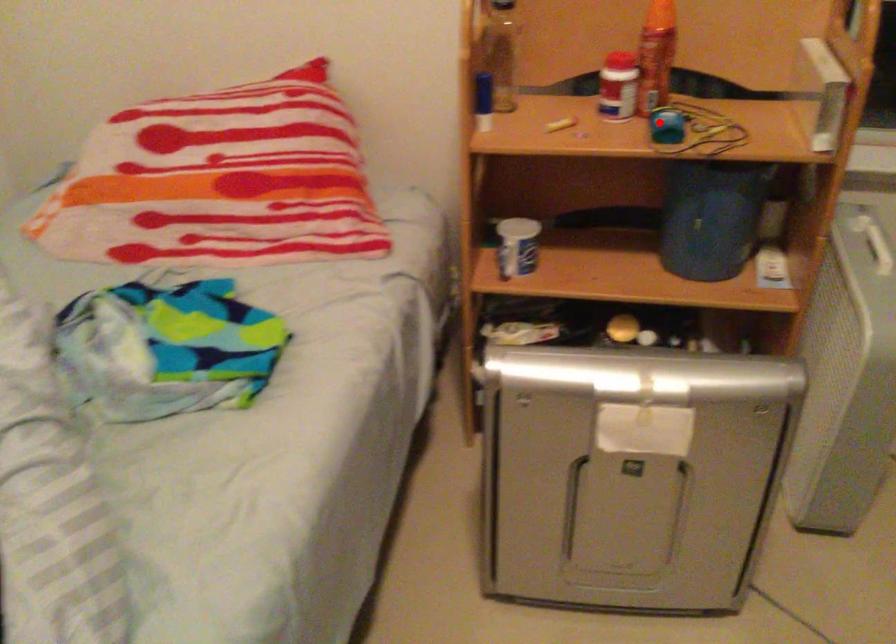
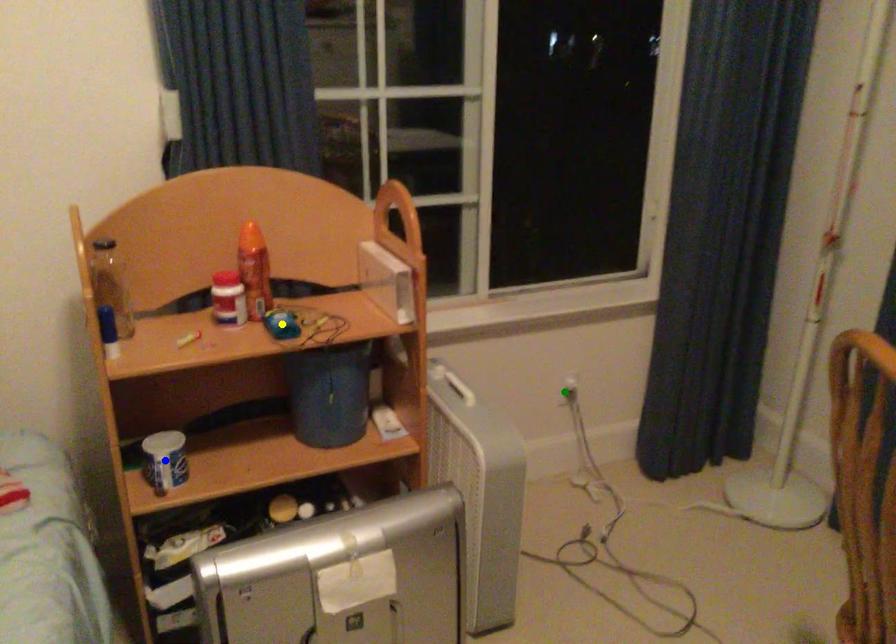
Question: I am providing you with two images of the same scene from different viewpoints. A red point is marked on the first image. You are given multiple points on the second image. Which point in image 2 represents the same 3d spot as the red point in image 1?

Choices:
 (A) yellow point
 (B) blue point
 (C) green point

Answer: (A)